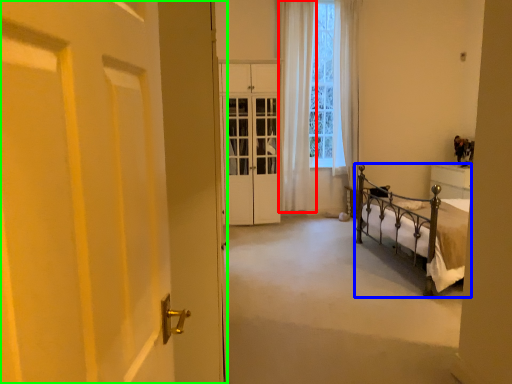
Question: Based on their relative distances, which object is nearer to curtain (highlighted by a red box)? Choose from bed (highlighted by a blue box) and door (highlighted by a green box).

Choices:
 (A) bed
 (B) door

Answer: (A)